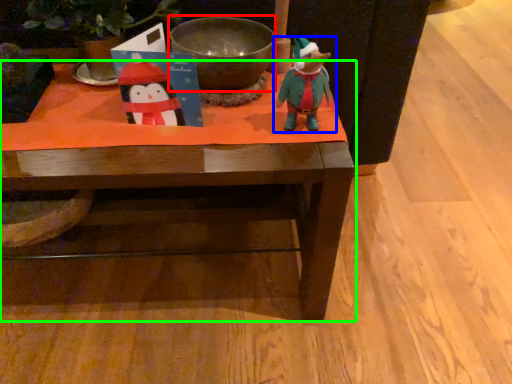
Question: Considering the real-world distances, which object is closest to bowl (highlighted by a red box)? toy (highlighted by a blue box) or table (highlighted by a green box).

Choices:
 (A) toy
 (B) table

Answer: (A)